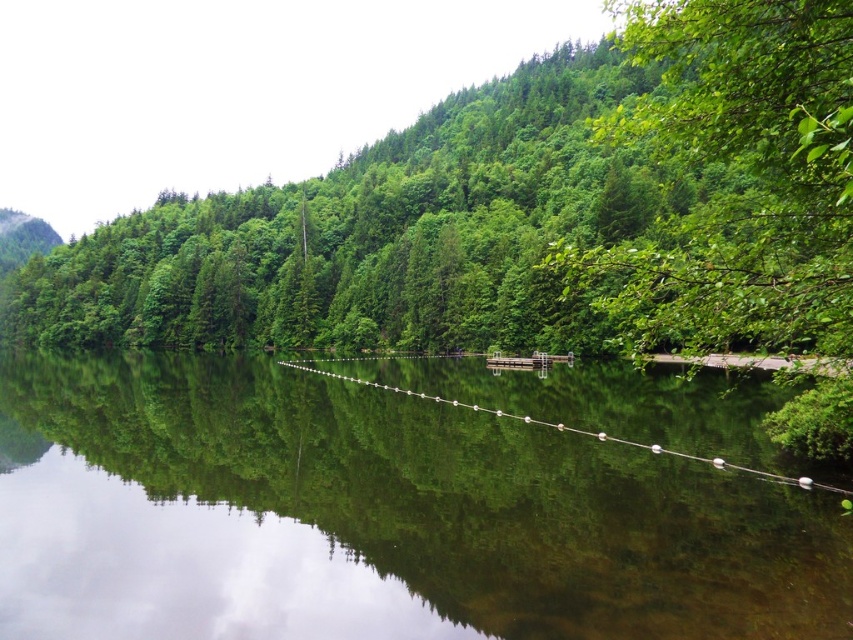
Does green leafy tree at center have a lesser height compared to green leafy tree at right?

No.

Does point (680, 177) come closer to viewer compared to point (735, 209)?

No, (680, 177) is further to viewer.

The width and height of the screenshot is (853, 640). Describe the element at coordinates (523, 212) in the screenshot. I see `green leafy tree at center` at that location.

At what (x,y) coordinates should I click in order to perform the action: click on green leafy tree at center. Please return your answer as a coordinate pair (x, y). The image size is (853, 640). Looking at the image, I should click on (523, 212).

Between clear water at center and green leafy tree at center, which one appears on the right side from the viewer's perspective?

green leafy tree at center

Can you confirm if clear water at center is thinner than green leafy tree at center?

Indeed, clear water at center has a lesser width compared to green leafy tree at center.

Which is in front, point (561, 390) or point (178, 320)?

Point (561, 390) is more forward.

You are a GUI agent. You are given a task and a screenshot of the screen. Output one action in this format:
    pyautogui.click(x=<x>, y=<y>)
    Task: Click on the clear water at center
    
    Given the screenshot: What is the action you would take?
    pyautogui.click(x=374, y=516)

Image resolution: width=853 pixels, height=640 pixels. Describe the element at coordinates (374, 516) in the screenshot. I see `clear water at center` at that location.

In order to click on clear water at center in this screenshot , I will do `click(374, 516)`.

The width and height of the screenshot is (853, 640). What are the coordinates of `clear water at center` in the screenshot? It's located at (374, 516).